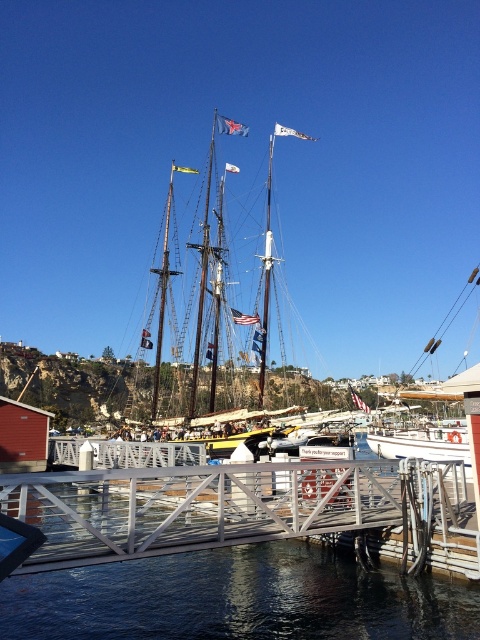
You are a tour guide explaining the harbor scene to visitors. You mention both the wooden ship at center and the white matte sailboat at center. Which one is smaller in size?

The wooden ship at center is smaller than the white matte sailboat at center according to the description.